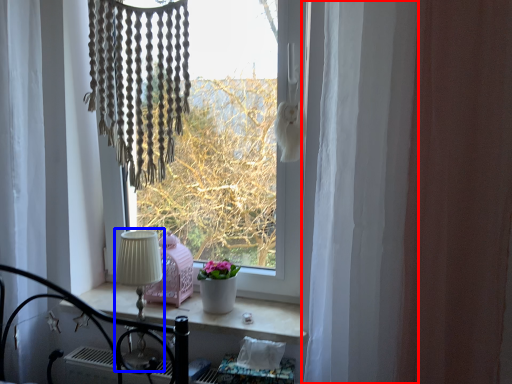
Question: Among these objects, which one is nearest to the camera, curtain (highlighted by a red box) or table lamp (highlighted by a blue box)?

Choices:
 (A) curtain
 (B) table lamp

Answer: (A)